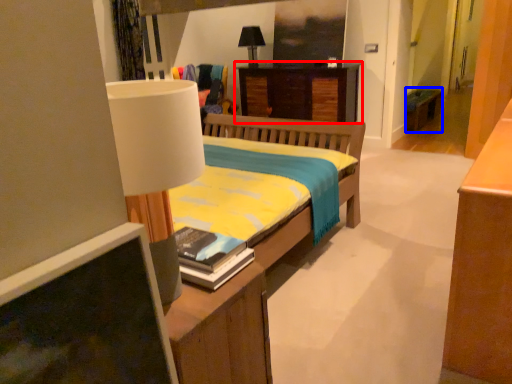
Question: Which object is closer to the camera taking this photo, desk (highlighted by a red box) or table (highlighted by a blue box)?

Choices:
 (A) desk
 (B) table

Answer: (A)